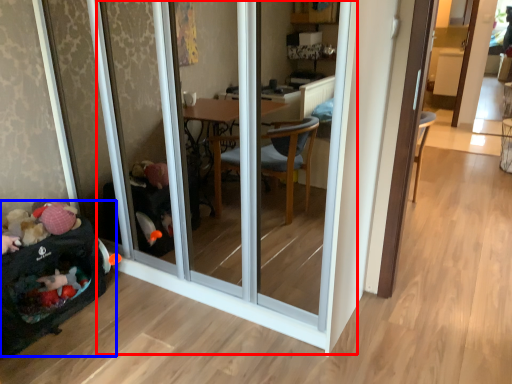
Question: Which of the following is the farthest to the observer, screen door (highlighted by a red box) or baby carriage (highlighted by a blue box)?

Choices:
 (A) screen door
 (B) baby carriage

Answer: (B)